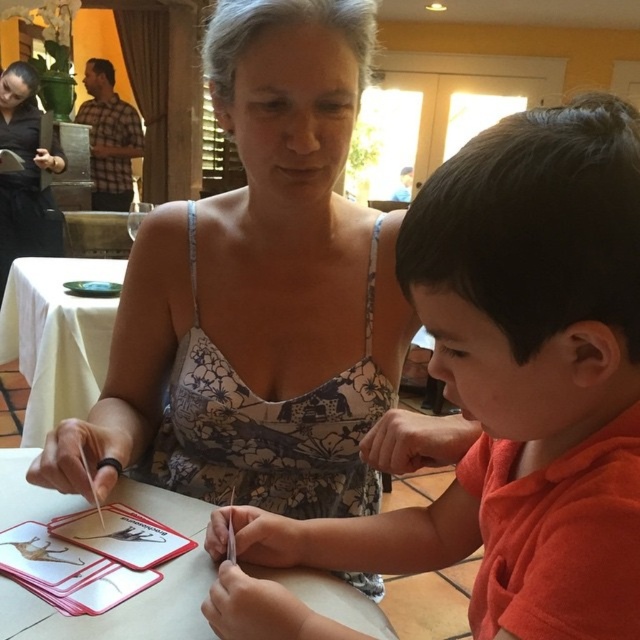
You are a child who wants to place a card on the wooden table at center. The card is 10 inches long. Can you fit the card on the table?

The wooden table at center is 21.83 inches long, so the card can be placed on it since it is shorter than the table.

You are a guest at this table and want to place your drink on the wooden table at center. Considering the height of the black floral dress at center, will the drink be stable on the table?

A: The wooden table at center is not as tall as the black floral dress at center, meaning the table is shorter. Since the table is shorter, placing the drink on it may not be stable if the table is too low. However, tables are typically designed to be stable regardless of their height, so the drink should remain stable as long as the table surface is level and the glass is placed securely.

You are organizing a game and need to place a small toy between the orange matte shirt at center and the white cloth at lower left. Which object should the toy be closer to based on their sizes?

The orange matte shirt at center occupies less space than the white cloth at lower left, so the toy should be placed closer to the orange matte shirt at center to account for its smaller size.